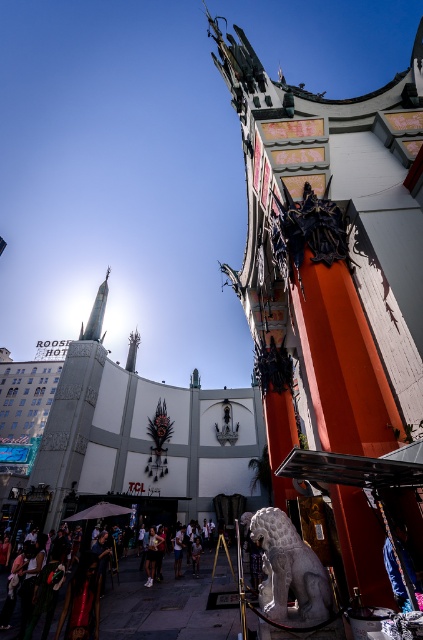
Question: Which is nearer to the dark blue jeans at center?

Choices:
 (A) white cotton shirt at center
 (B) gray stone lion at lower center
 (C) dark bronze statue at upper center
 (D) light brown leather jacket at center

Answer: (D)

Question: Is dark bronze statue at upper center closer to camera compared to light brown leather jacket at center?

Choices:
 (A) no
 (B) yes

Answer: (B)

Question: Among these objects, which one is nearest to the camera?

Choices:
 (A) light brown leather jacket at center
 (B) white stone crowd at lower left
 (C) dark blue jeans at center

Answer: (B)

Question: In this image, where is white stone crowd at lower left located relative to dark blue jeans at center?

Choices:
 (A) right
 (B) left

Answer: (B)

Question: Does white stone crowd at lower left appear under dark blue jeans at center?

Choices:
 (A) yes
 (B) no

Answer: (B)

Question: Which point is farther to the camera?

Choices:
 (A) (153, 540)
 (B) (195, 572)

Answer: (B)